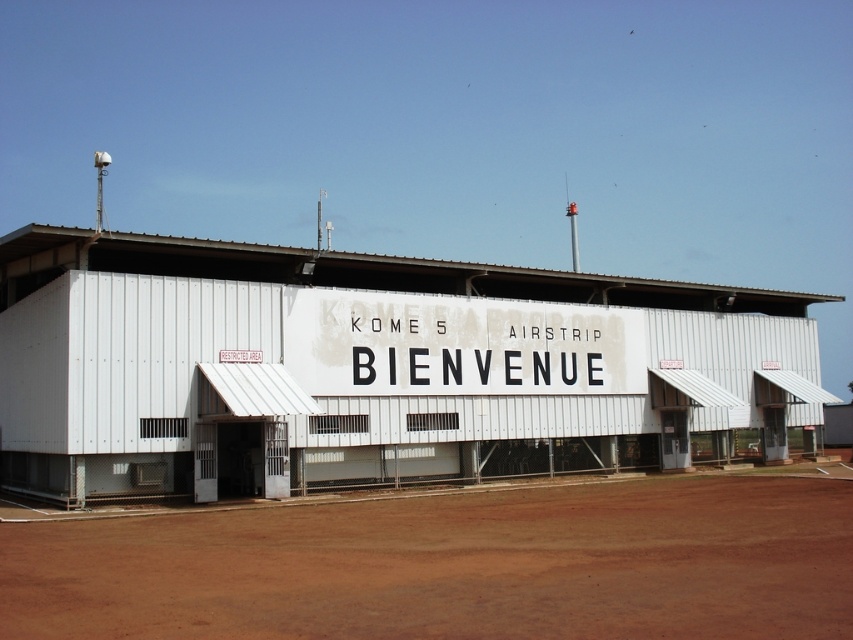
Between point (654, 397) and point (741, 621), which one is positioned behind?

Positioned behind is point (654, 397).

Does white corrugated metal shed at center lie behind brown dirt field at lower center?

Yes, it is behind brown dirt field at lower center.

At what (x,y) coordinates should I click in order to perform the action: click on white corrugated metal shed at center. Please return your answer as a coordinate pair (x, y). Looking at the image, I should click on (x=372, y=369).